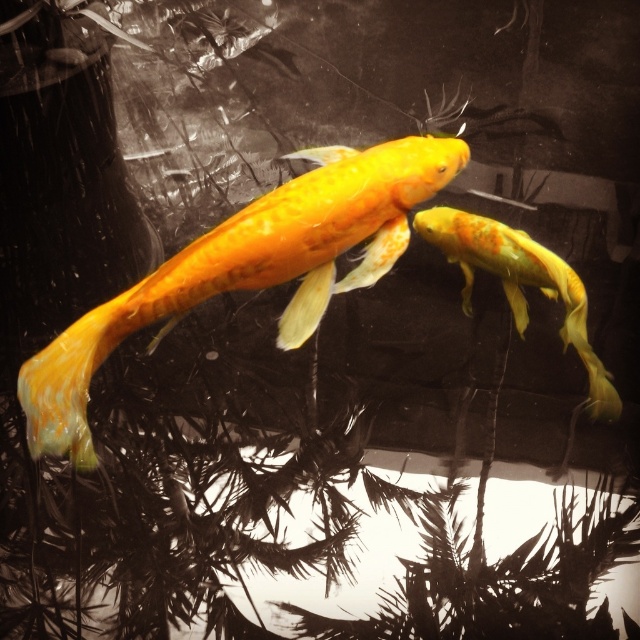
You are an aquarium caretaker who needs to determine if both shiny yellow fish at center and shiny orange goldfish at center can fit side by side in a 15 cm wide tank section. Given their widths, can they fit?

The shiny yellow fish at center is wider than the shiny orange goldfish at center. If their combined widths are less than or equal to 15 cm, they can fit. However, without knowing their exact widths, it is impossible to determine definitively.

You are an aquarium caretaker who needs to feed two shiny yellow fish at center. The feeding area is 3 feet wide. Can both fish fit into the feeding area at the same time?

The shiny yellow fish at center are 3.52 feet apart. Since the feeding area is only 3 feet wide, the distance between them is greater than the feeding area width. Therefore, both fish cannot fit into the feeding area simultaneously.

You are an underwater photographer aiming to capture a clear photo of the shiny yellow fish at center and the shiny orange goldfish at center. Which fish should you focus on first to ensure it appears sharp in your photo?

The shiny yellow fish at center is in front of the shiny orange goldfish at center, so you should focus on the shiny yellow fish at center first to ensure it appears sharp in your photo.